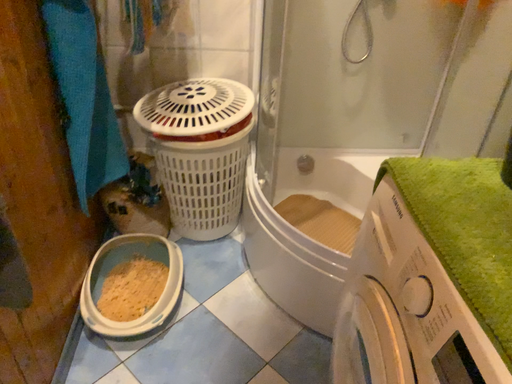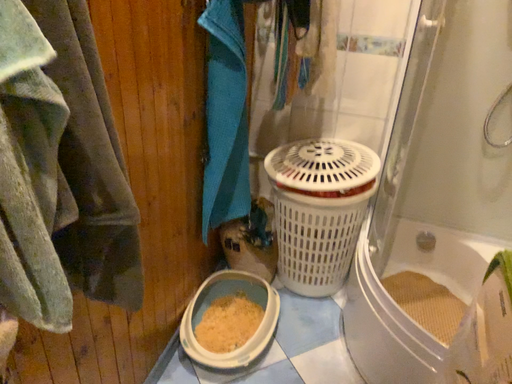
Question: Which way did the camera rotate in the video?

Choices:
 (A) rotated upward
 (B) rotated downward

Answer: (A)